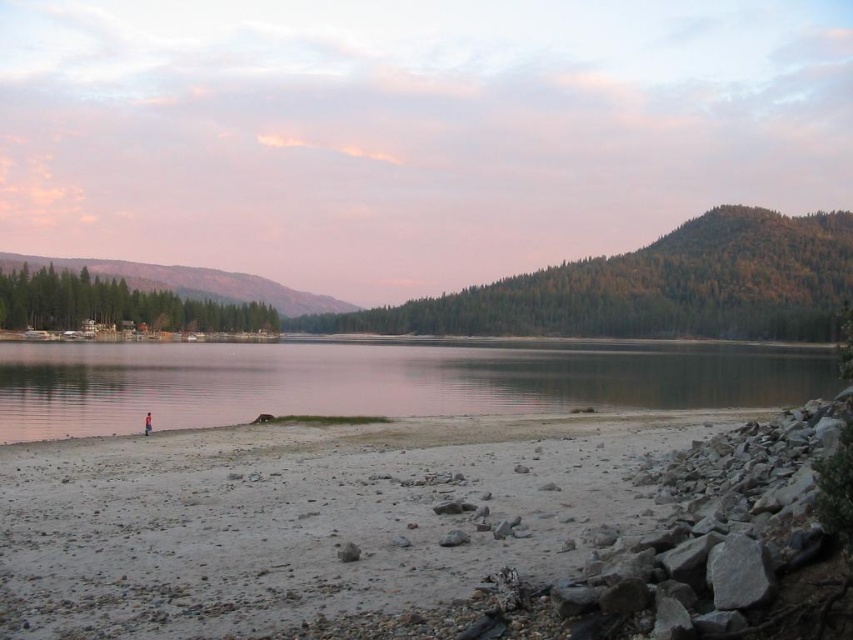
Question: From the image, what is the correct spatial relationship of green forested mountain at center in relation to green forested mountain at left?

Choices:
 (A) left
 (B) right

Answer: (B)

Question: Considering the relative positions of smooth sand beach at lower left and clear water at center in the image provided, where is smooth sand beach at lower left located with respect to clear water at center?

Choices:
 (A) right
 (B) left

Answer: (A)

Question: Which point is farther from the camera taking this photo?

Choices:
 (A) (59, 536)
 (B) (814, 300)
 (C) (265, 291)
 (D) (407, 394)

Answer: (C)

Question: Among these objects, which one is farthest from the camera?

Choices:
 (A) smooth sand beach at lower left
 (B) clear water at center
 (C) green forested mountain at center

Answer: (C)

Question: Considering the real-world distances, which object is closest to the smooth sand beach at lower left?

Choices:
 (A) clear water at center
 (B) green forested mountain at center
 (C) green forested mountain at left

Answer: (A)

Question: Where is clear water at center located in relation to green forested mountain at left in the image?

Choices:
 (A) below
 (B) above

Answer: (A)